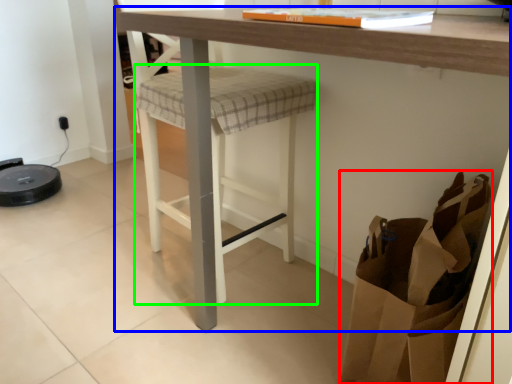
Question: Based on their relative distances, which object is farther from shopping bag (highlighted by a red box)? Choose from table (highlighted by a blue box) and step stool (highlighted by a green box).

Choices:
 (A) table
 (B) step stool

Answer: (B)